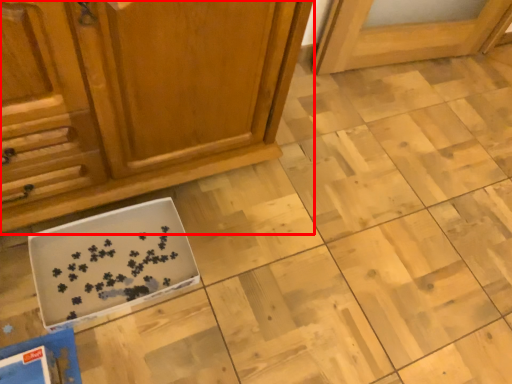
Question: Observing the image, what is the correct spatial positioning of cabinetry (annotated by the red box) in reference to cardboard box?

Choices:
 (A) left
 (B) right

Answer: (B)